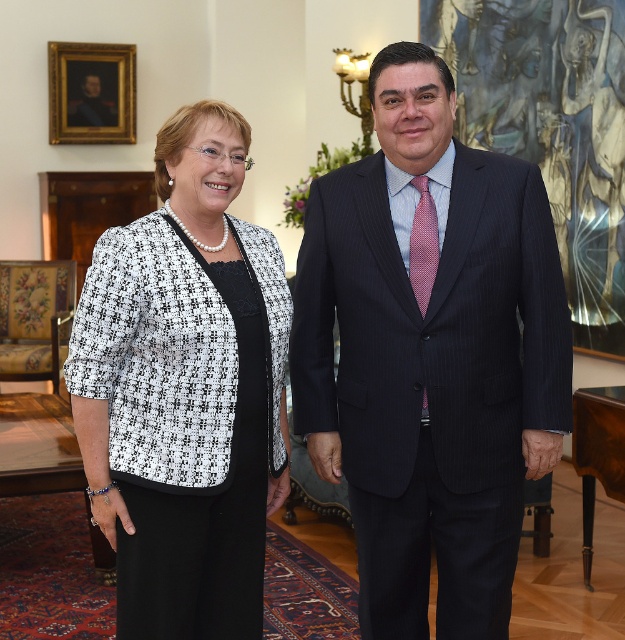
Is black tweed blazer at center further to the viewer compared to goldwooden frame at upper left?

No, black tweed blazer at center is closer to the viewer.

Does point (238, 253) come farther from viewer compared to point (66, 81)?

That is False.

Identify the location of black tweed blazer at center. Image resolution: width=625 pixels, height=640 pixels. point(186,390).

Can you confirm if pinstriped wool suit at center is smaller than goldwooden frame at upper left?

Incorrect, pinstriped wool suit at center is not smaller in size than goldwooden frame at upper left.

Does pinstriped wool suit at center have a lesser height compared to goldwooden frame at upper left?

In fact, pinstriped wool suit at center may be taller than goldwooden frame at upper left.

What do you see at coordinates (432, 381) in the screenshot? The image size is (625, 640). I see `pinstriped wool suit at center` at bounding box center [432, 381].

I want to click on pinstriped wool suit at center, so click(432, 381).

Is pinstriped wool suit at center positioned before black tweed blazer at center?

No.

Between point (508, 332) and point (148, 506), which one is positioned behind?

The point (508, 332) is behind.

Where is `pinstriped wool suit at center`? The width and height of the screenshot is (625, 640). pinstriped wool suit at center is located at coordinates (432, 381).